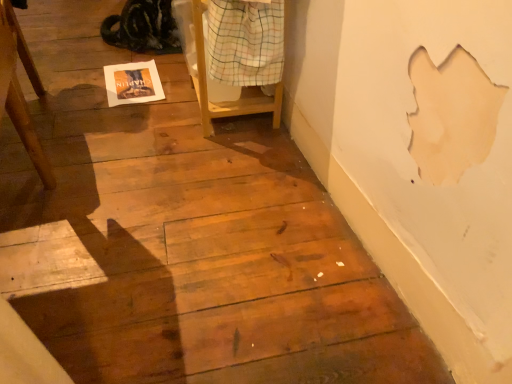
What do you see at coordinates (207, 88) in the screenshot? The image size is (512, 384). I see `wooden table at upper center` at bounding box center [207, 88].

This screenshot has width=512, height=384. In order to click on wooden table at upper center in this screenshot , I will do `click(207, 88)`.

In order to click on wooden table at upper center in this screenshot , I will do `click(207, 88)`.